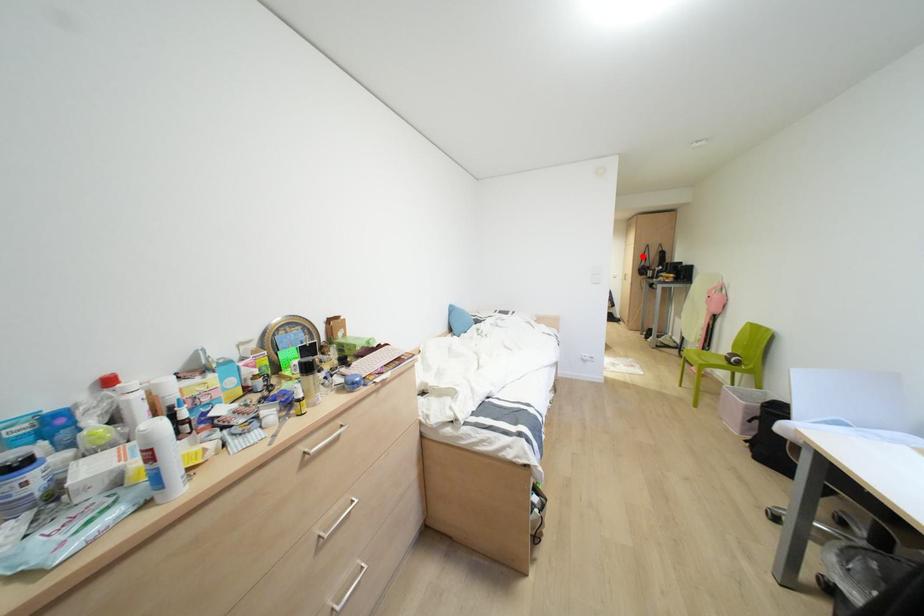
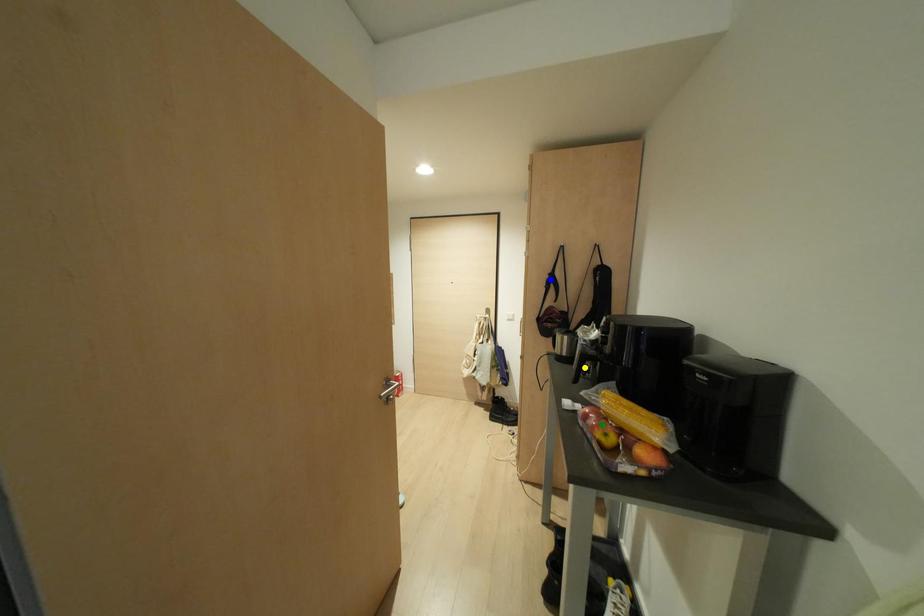
Question: I am providing you with two images of the same scene from different viewpoints. A red point is marked on the first image. You are given multiple points on the second image. Can you choose the point in image 2 that corresponds to the point in image 1?

Choices:
 (A) blue point
 (B) yellow point
 (C) green point

Answer: (A)